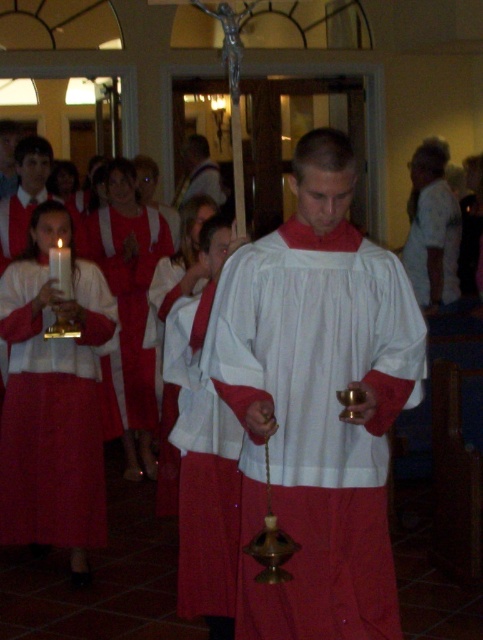
You are an event planner organizing a religious ceremony. You have two items to place on a narrow table that can only accommodate one of them. The items are the matte white robe at left and the white matte fabric at center. Based on their sizes, which item should you choose to fit on the table?

The white matte fabric at center should be chosen because it is narrower than the matte white robe at left, which is wider and may not fit on the narrow table.

You are a photographer standing in the church and want to capture a closeup shot of the matte white robe at left and the white matte fabric at center. The camera you are using has a minimum focusing distance of 36 inches. Can you take the photo without moving either object?

The distance between the matte white robe at left and the white matte fabric at center is 36.70 inches. Since the camera requires at least 36 inches to focus, you can take the photo without moving the objects.